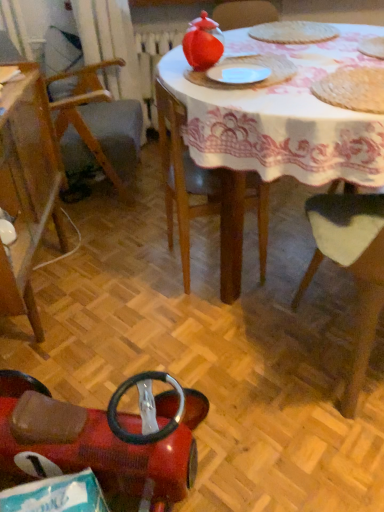
I want to click on vacant space behind rubberized red toy car at lower left, the 2th chair positioned from the right, so click(x=137, y=340).